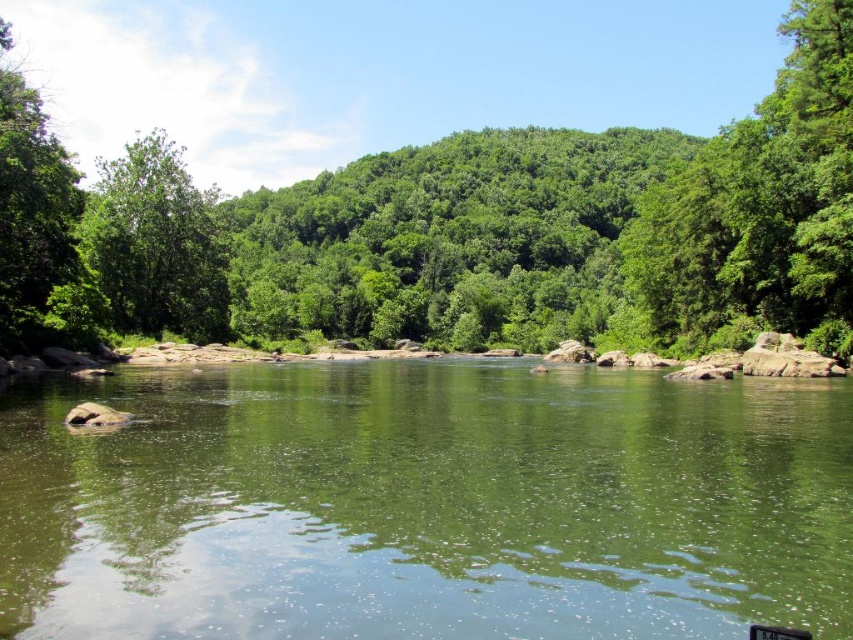
Question: Does green leafy tree at upper left have a greater width compared to green leafy tree at left?

Choices:
 (A) yes
 (B) no

Answer: (A)

Question: Is green leafy tree at center behind green leafy tree at upper left?

Choices:
 (A) yes
 (B) no

Answer: (B)

Question: Which object appears farthest from the camera in this image?

Choices:
 (A) green leafy tree at center
 (B) green leafy tree at left
 (C) green smooth water at center
 (D) green leafy tree at upper left

Answer: (D)

Question: Does green leafy tree at upper left have a greater width compared to green leafy tree at left?

Choices:
 (A) yes
 (B) no

Answer: (A)

Question: Which of the following is the farthest from the observer?

Choices:
 (A) (189, 216)
 (B) (91, 625)
 (C) (0, 298)

Answer: (A)

Question: Which is farther from the green smooth water at center?

Choices:
 (A) green leafy tree at center
 (B) green leafy tree at left

Answer: (A)